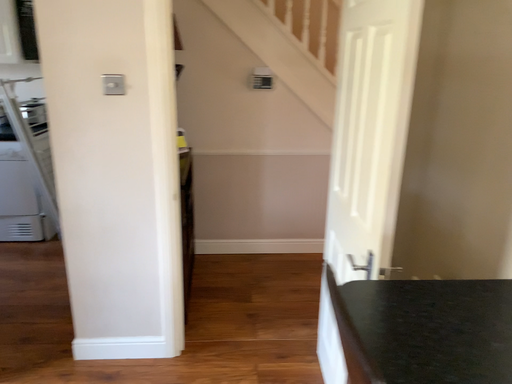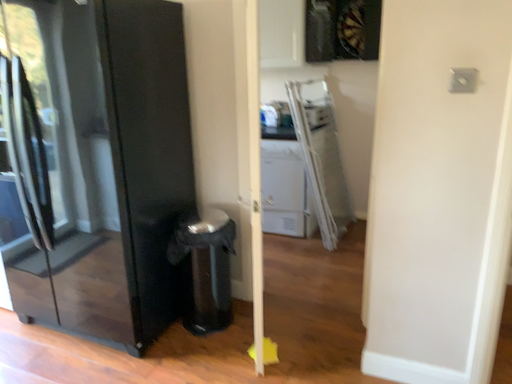
Question: Which way did the camera rotate in the video?

Choices:
 (A) rotated right
 (B) rotated left

Answer: (B)